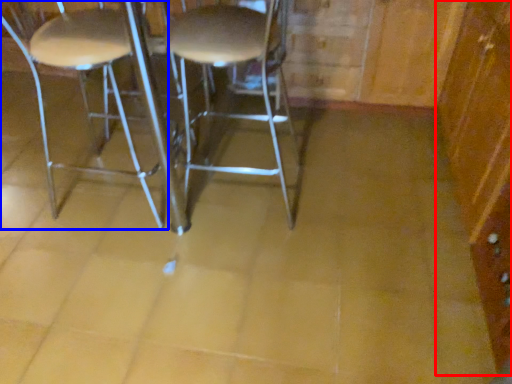
Question: Which object is closer to the camera taking this photo, dresser (highlighted by a red box) or chair (highlighted by a blue box)?

Choices:
 (A) dresser
 (B) chair

Answer: (A)